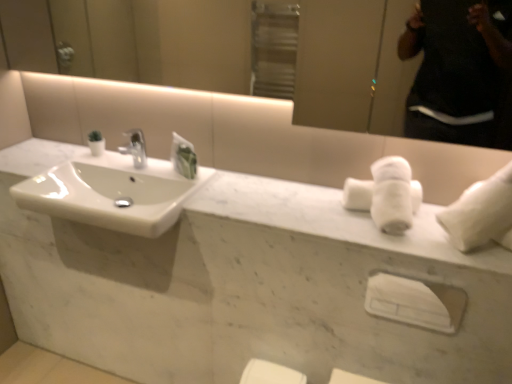
Find the location of a particular element. This screenshot has width=512, height=384. blank area beneath white fluffy bath towel at upper right, marked as the 2th bath towel in a right-to-left arrangement (from a real-world perspective) is located at coordinates (365, 215).